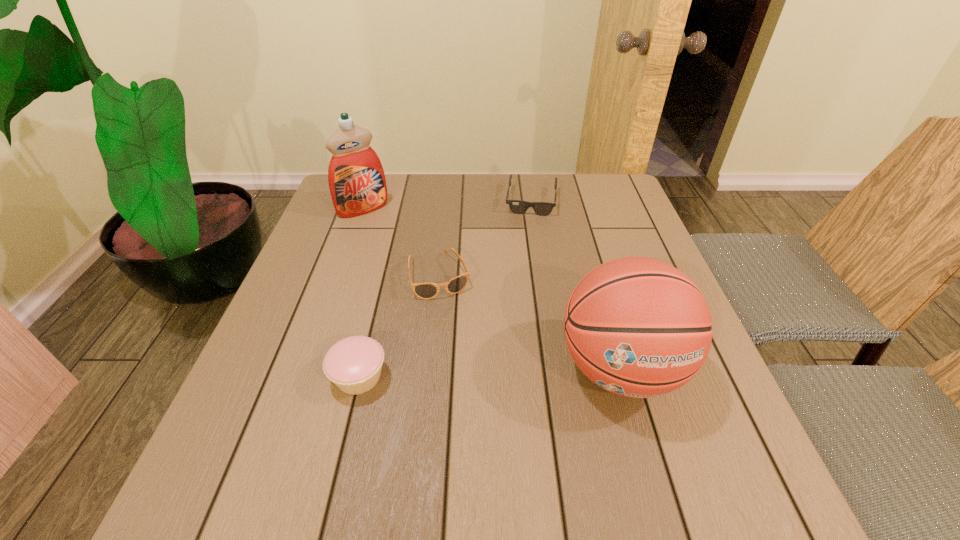
Locate an element on the screen. This screenshot has height=540, width=960. vacant area between the farther sunglasses and the detergent is located at coordinates (447, 205).

Image resolution: width=960 pixels, height=540 pixels. Find the location of `free space between the farther sunglasses and the nearer sunglasses`. free space between the farther sunglasses and the nearer sunglasses is located at coordinates (486, 238).

You are a GUI agent. You are given a task and a screenshot of the screen. Output one action in this format:
    pyautogui.click(x=<x>, y=<y>)
    Task: Click on the vacant area that lies between the cupcake and the detergent
    
    Given the screenshot: What is the action you would take?
    pyautogui.click(x=361, y=293)

This screenshot has width=960, height=540. Identify the location of free space between the cupcake and the basketball. (490, 373).

This screenshot has width=960, height=540. I want to click on unoccupied area between the basketball and the third tallest object, so click(x=490, y=373).

Find the location of a particular element. The image size is (960, 540). free point between the left sunglasses and the right sunglasses is located at coordinates (486, 238).

You are a GUI agent. You are given a task and a screenshot of the screen. Output one action in this format:
    pyautogui.click(x=<x>, y=<y>)
    Task: Click on the free space that is in between the nearer sunglasses and the basketball
    Image resolution: width=960 pixels, height=540 pixels.
    Given the screenshot: What is the action you would take?
    pyautogui.click(x=530, y=322)

Where is `object that is the fourth closest to the basketball`? The image size is (960, 540). object that is the fourth closest to the basketball is located at coordinates click(x=356, y=178).

At what (x,y) coordinates should I click in order to perform the action: click on object that is the fourth closest to the basketball. Please return your answer as a coordinate pair (x, y). Looking at the image, I should click on (356, 178).